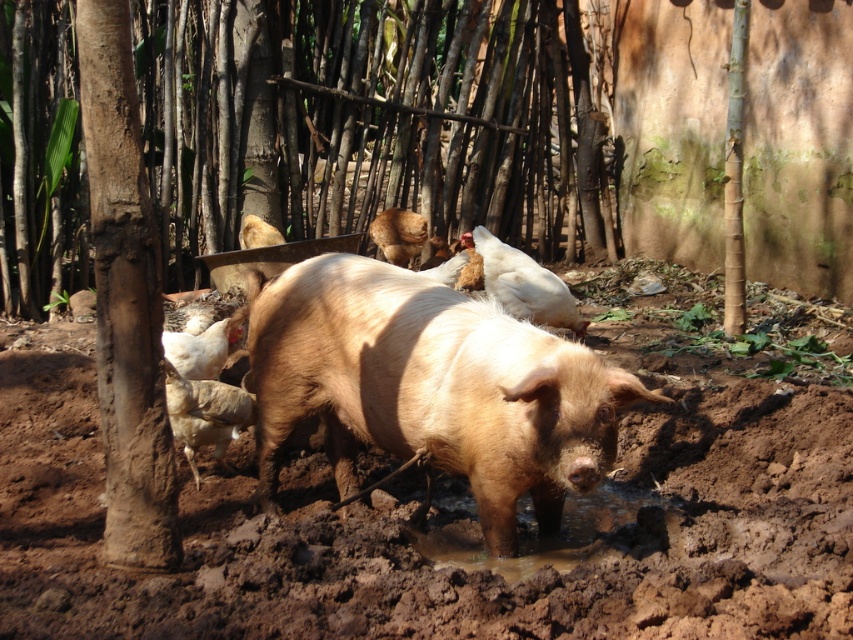
Question: Which point appears farthest from the camera in this image?

Choices:
 (A) (395, 262)
 (B) (543, 369)
 (C) (567, 544)
 (D) (263, 227)

Answer: (A)

Question: Can you confirm if light brown glossy pig at center is bigger than brown matte pig at upper center?

Choices:
 (A) yes
 (B) no

Answer: (A)

Question: Where is muddy wet puddle at lower center located in relation to brown matte pig at upper center in the image?

Choices:
 (A) left
 (B) right

Answer: (B)

Question: Which object is farther from the camera taking this photo?

Choices:
 (A) light brown fur at center
 (B) brown wet mud at center

Answer: (A)

Question: Which point appears closest to the camera in this image?

Choices:
 (A) (688, 636)
 (B) (419, 248)
 (C) (456, 314)
 (D) (585, 554)

Answer: (A)

Question: Is light brown glossy pig at center to the left of muddy wet puddle at lower center from the viewer's perspective?

Choices:
 (A) yes
 (B) no

Answer: (A)